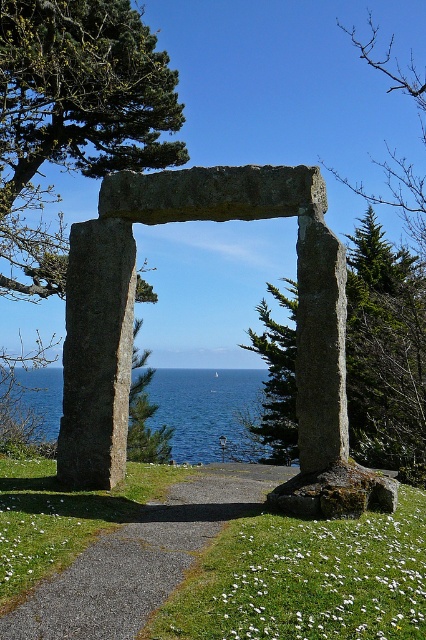
Does point (106, 378) lie in front of point (58, 435)?

That is True.

Is granite stone arch at center to the left of smooth gray stone pillar at center from the viewer's perspective?

No, granite stone arch at center is not to the left of smooth gray stone pillar at center.

Is point (71, 406) closer to viewer compared to point (114, 472)?

Yes, point (71, 406) is in front of point (114, 472).

Find the location of a particular element. granite stone arch at center is located at coordinates (132, 307).

Who is taller, green mossy stone at center or blue water at center?

green mossy stone at center is taller.

Is point (282, 326) less distant than point (181, 449)?

That is True.

Which is behind, point (420, 364) or point (236, 440)?

Point (236, 440)

At what (x,y) coordinates should I click in order to perform the action: click on green mossy stone at center. Please return your answer as a coordinate pair (x, y). Looking at the image, I should click on (385, 353).

Who is taller, gravel path at center or smooth gray stone pillar at center?

smooth gray stone pillar at center is taller.

Which is behind, point (55, 593) or point (100, 275)?

Point (100, 275)

Locate an element on the screen. gravel path at center is located at coordinates click(x=140, y=557).